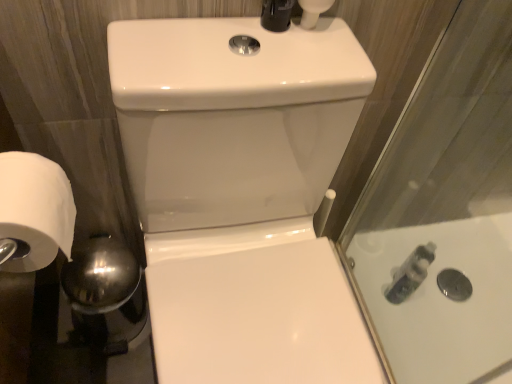
Where is `vacant space behind translucent plastic bottle at right`? The width and height of the screenshot is (512, 384). vacant space behind translucent plastic bottle at right is located at coordinates (383, 256).